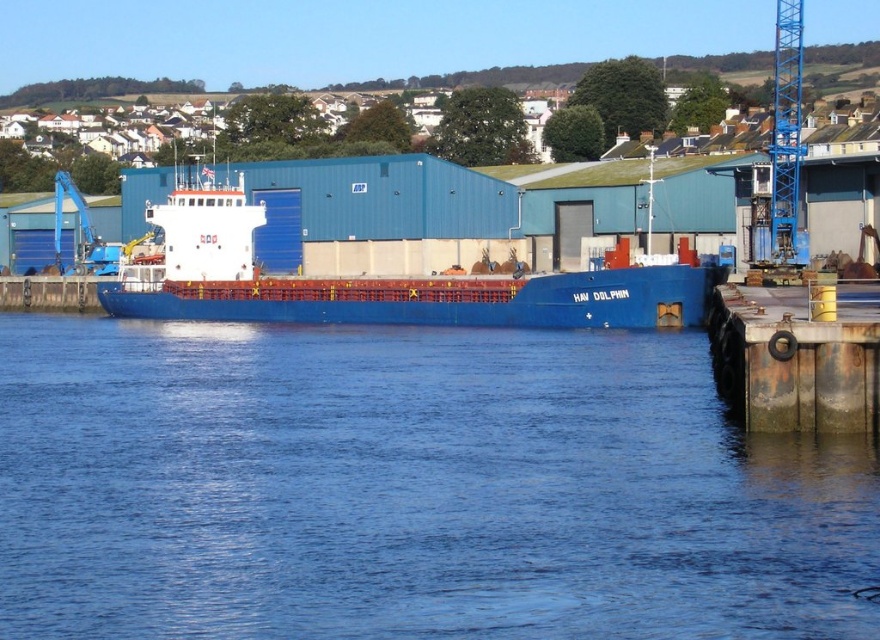
Looking at this image, you are standing at the port and want to reach the point marked at coordinates (385,323). If your walking speed is 1.5 meters per second, how long will it take you to reach that point?

The point marked at coordinates (385,323) is 81.27 meters away from the viewer. At a walking speed of 1.5 meters per second, it would take approximately 54.18 seconds to reach the point.

You are a crane operator who needs to move a heavy container from the rusty metal dock at lower right to the blue metallic crane at upper right. Considering their sizes, can you safely maneuver the container between them?

The rusty metal dock at lower right is thinner than the blue metallic crane at upper right, so there might be enough space to maneuver the container between them. However, the exact feasibility depends on the container size and the clearance between the two structures.